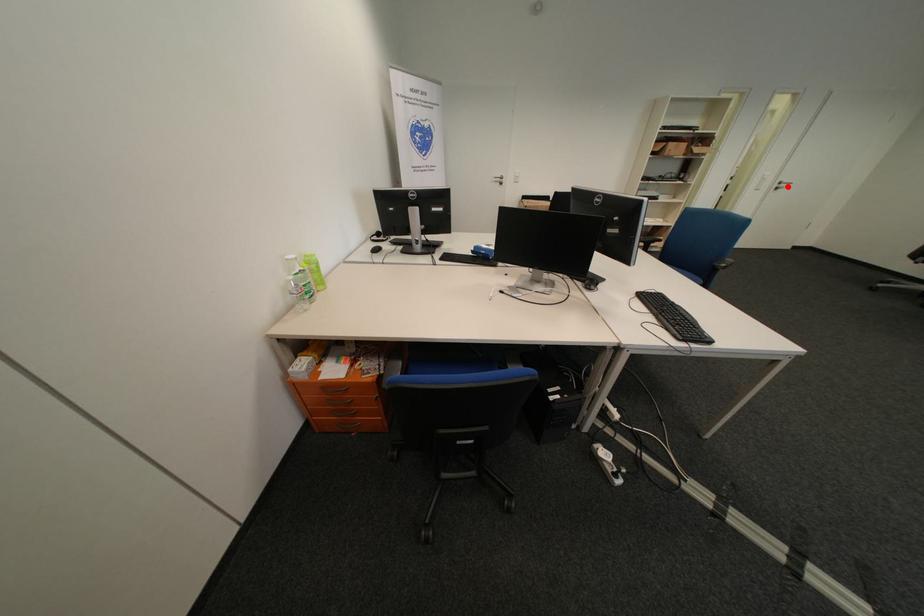
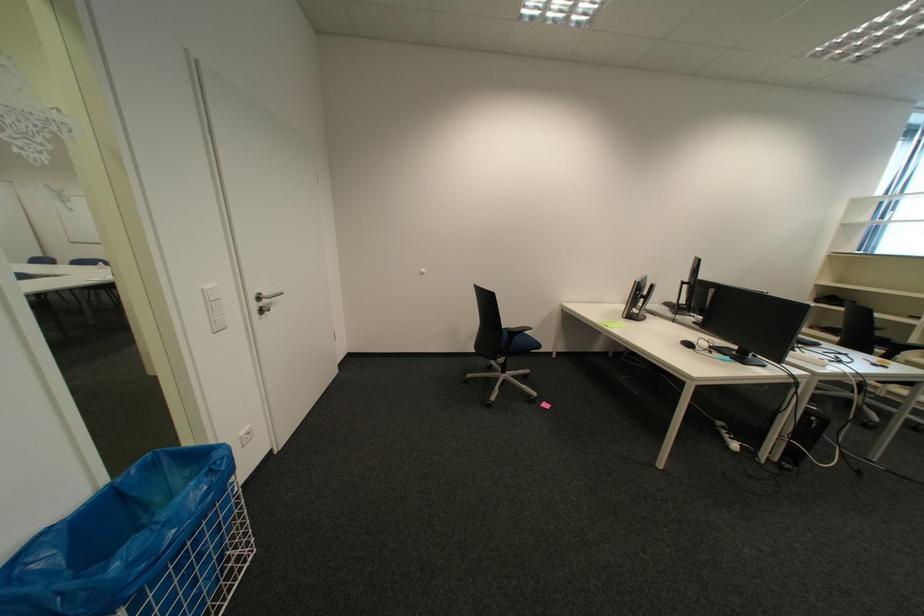
Find the pixel in the second image that matches the highlighted location in the first image.

(266, 307)